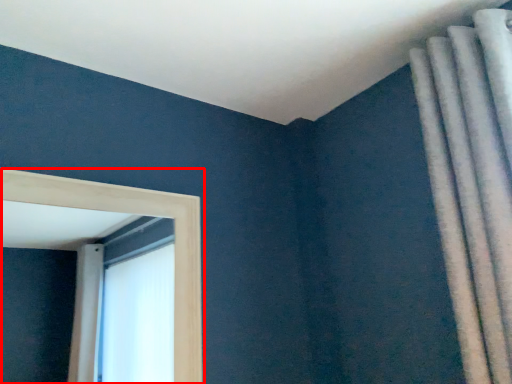
Question: From the image's perspective, considering the relative positions of window (annotated by the red box) and curtain in the image provided, where is window (annotated by the red box) located with respect to the staircase?

Choices:
 (A) below
 (B) above

Answer: (A)